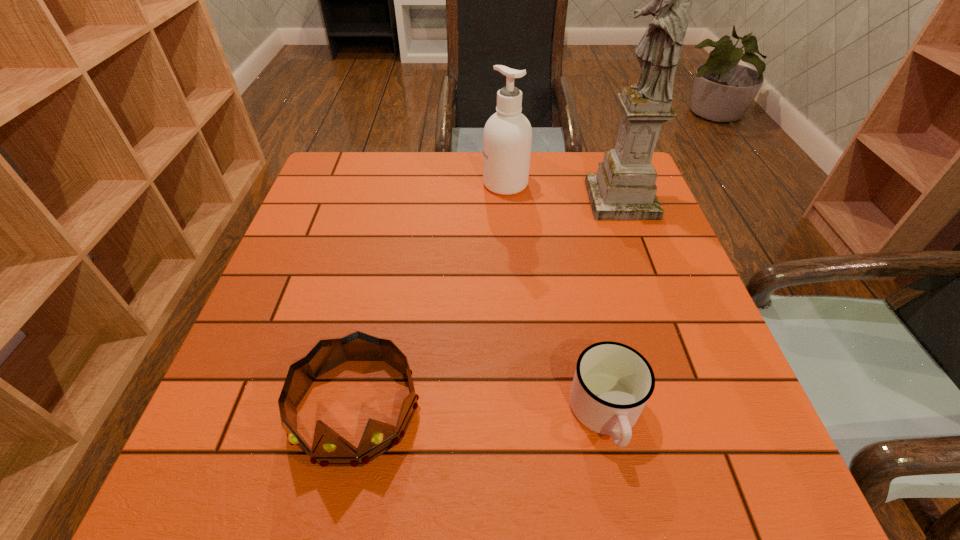
Locate an element on the screen. The height and width of the screenshot is (540, 960). vacant area that lies between the sculpture and the shortest object is located at coordinates (613, 307).

Identify the location of vacant space that is in between the second object from right to left and the sculpture. (613, 307).

Find the location of a particular element. empty space that is in between the leftmost object and the sculpture is located at coordinates (488, 305).

Where is `vacant area between the leftmost object and the tallest object`? vacant area between the leftmost object and the tallest object is located at coordinates (488, 305).

This screenshot has width=960, height=540. In order to click on free space between the cleansing agent and the rightmost object in this screenshot , I will do `click(564, 192)`.

Identify the location of unoccupied position between the third object from left to right and the tiara. (480, 411).

Find the location of `empty location between the cleansing agent and the tiara`. empty location between the cleansing agent and the tiara is located at coordinates (430, 296).

You are a GUI agent. You are given a task and a screenshot of the screen. Output one action in this format:
    pyautogui.click(x=<x>, y=<y>)
    Task: Click on the empty space between the tallest object and the cleansing agent
    
    Given the screenshot: What is the action you would take?
    pyautogui.click(x=564, y=192)

Where is `vacant area between the second shortest object and the sculpture`? vacant area between the second shortest object and the sculpture is located at coordinates (488, 305).

Point out which object is positioned as the second nearest to the second shortest object. Please provide its 2D coordinates. Your answer should be formatted as a tuple, i.e. [(x, y)], where the tuple contains the x and y coordinates of a point satisfying the conditions above.

[(507, 138)]